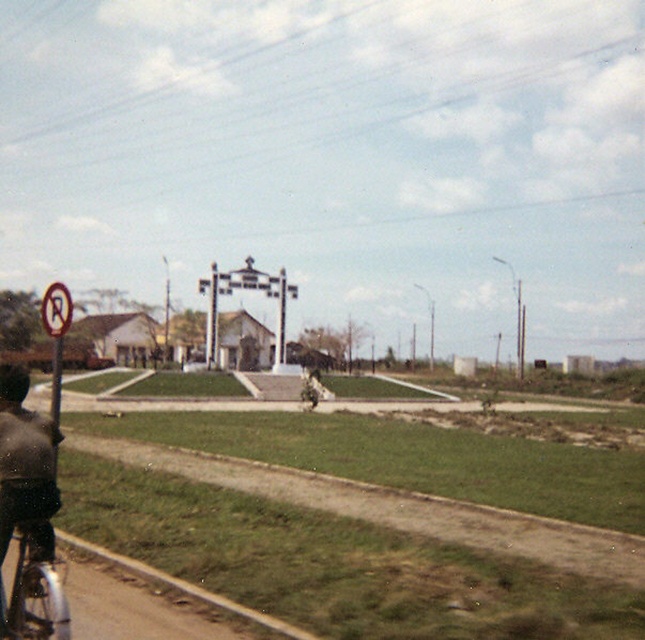
Is the position of silver metallic bicycle at lower left less distant than that of white plastic no parking sign at left?

Yes, silver metallic bicycle at lower left is closer to the viewer.

Is silver metallic bicycle at lower left to the left of white plastic no parking sign at left from the viewer's perspective?

No, silver metallic bicycle at lower left is not to the left of white plastic no parking sign at left.

Does point (1, 589) come closer to viewer compared to point (46, 294)?

That is True.

What are the coordinates of `silver metallic bicycle at lower left` in the screenshot? It's located at (32, 566).